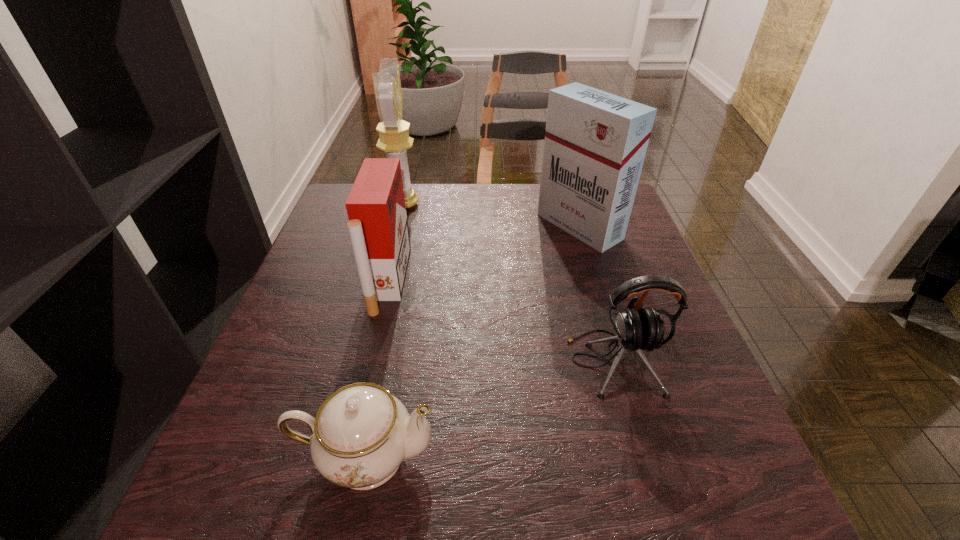
Identify the location of vacant space located 0.360m at the spout of the shortest object. Image resolution: width=960 pixels, height=540 pixels. (662, 456).

This screenshot has height=540, width=960. I want to click on award that is at the far edge, so click(394, 139).

The width and height of the screenshot is (960, 540). Find the location of `cigarette case situated at the far edge`. cigarette case situated at the far edge is located at coordinates (595, 144).

In order to click on object positioned at the near edge in this screenshot , I will do `click(361, 434)`.

You are a GUI agent. You are given a task and a screenshot of the screen. Output one action in this format:
    pyautogui.click(x=<x>, y=<y>)
    Task: Click on the award positioned at the left edge
    This screenshot has width=960, height=540.
    Given the screenshot: What is the action you would take?
    pyautogui.click(x=394, y=139)

Locate an element on the screen. chinaware positioned at the left edge is located at coordinates (361, 434).

Identify the location of cigarette case located in the right edge section of the desktop. (595, 144).

Image resolution: width=960 pixels, height=540 pixels. In order to click on earphone that is at the right edge in this screenshot , I will do `click(637, 329)`.

At what (x,y) coordinates should I click in order to perform the action: click on object located in the far left corner section of the desktop. Please return your answer as a coordinate pair (x, y). The height and width of the screenshot is (540, 960). Looking at the image, I should click on (394, 139).

Find the location of `object that is at the near left corner`. object that is at the near left corner is located at coordinates (361, 434).